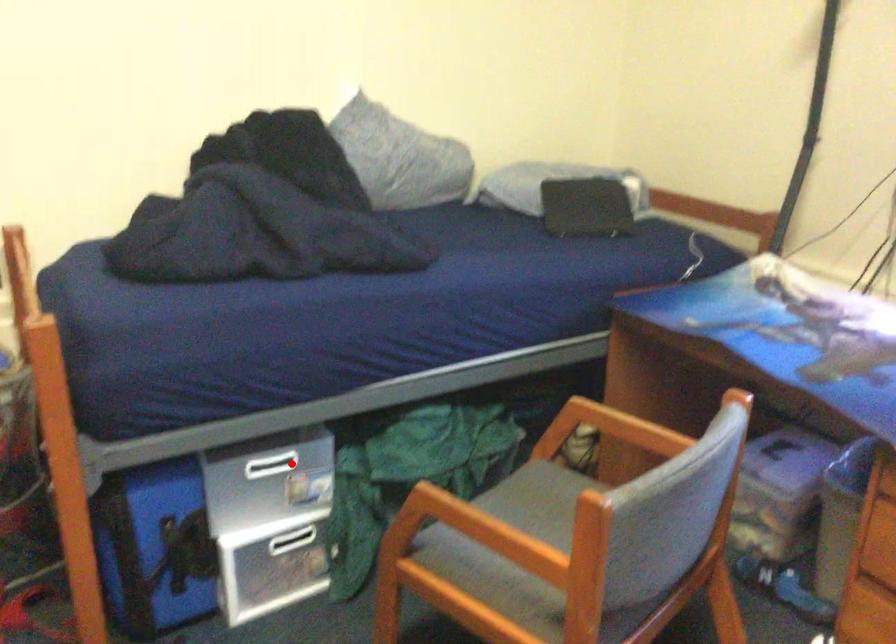
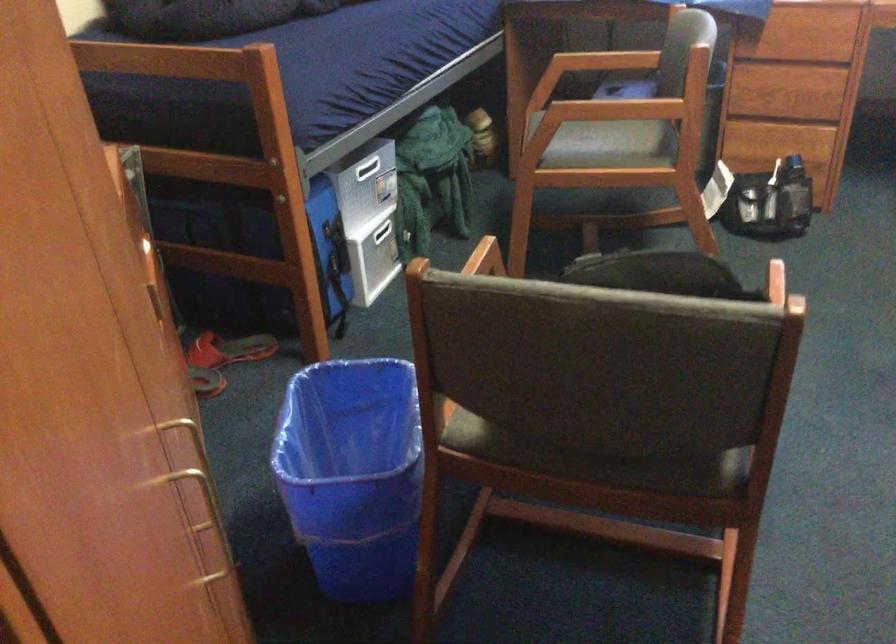
Question: I am providing you with two images of the same scene from different viewpoints. Given a red point in image1, look at the same physical point in image2. Is it:

Choices:
 (A) Closer to the viewpoint
 (B) Farther from the viewpoint

Answer: (B)